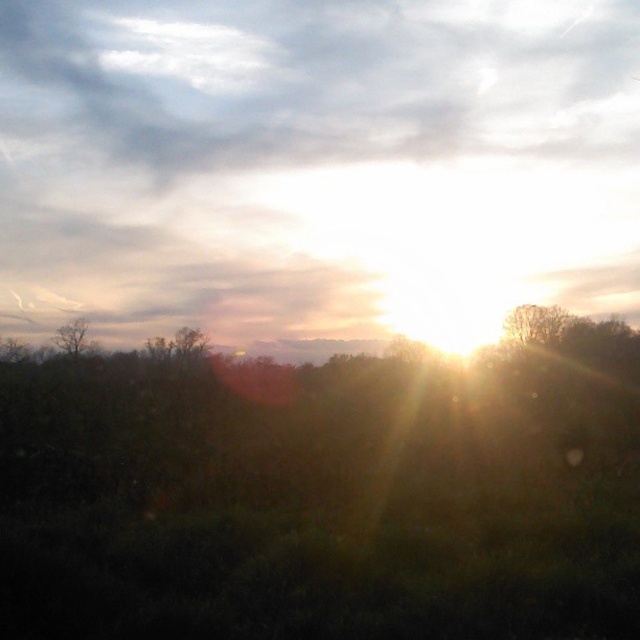
Is bare branches at center bigger than bare branches at left?

Actually, bare branches at center might be smaller than bare branches at left.

Is the position of bare branches at center more distant than that of bare branches at left?

No, it is not.

This screenshot has width=640, height=640. Describe the element at coordinates (532, 324) in the screenshot. I see `bare branches at center` at that location.

Where is `bare branches at center`? bare branches at center is located at coordinates (532, 324).